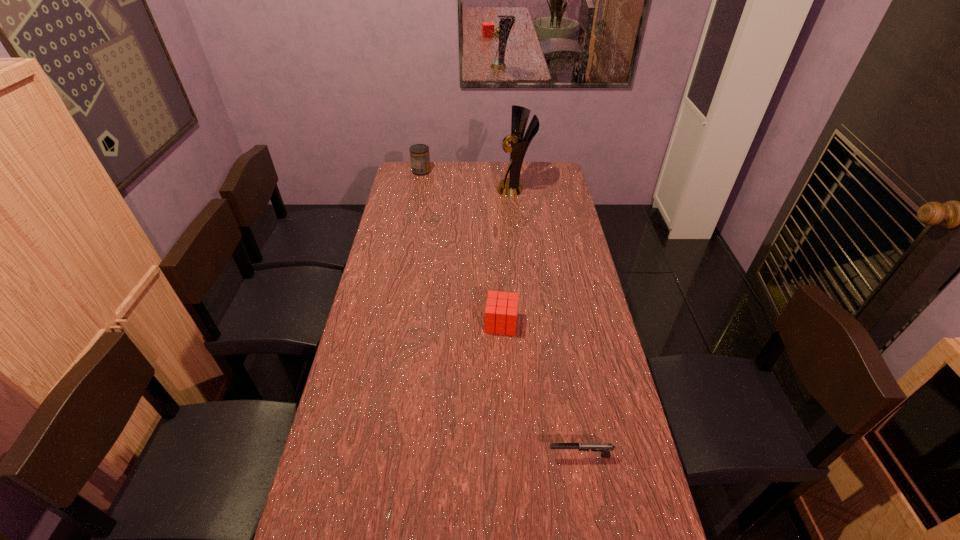
Choose which object is the third nearest neighbor to the shortest object. Please provide its 2D coordinates. Your answer should be formatted as a tuple, i.e. [(x, y)], where the tuple contains the x and y coordinates of a point satisfying the conditions above.

[(419, 153)]

Locate an element on the screen. object that is the second closest one to the can is located at coordinates (501, 311).